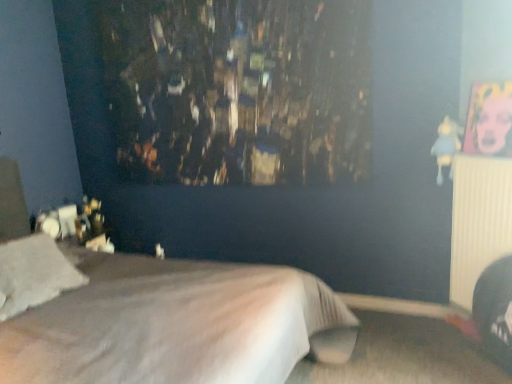
The height and width of the screenshot is (384, 512). What do you see at coordinates (34, 274) in the screenshot?
I see `white soft pillow at lower left` at bounding box center [34, 274].

Identify the location of white ribbed radiator at right. (478, 221).

Where is `white soft bed at center`? The image size is (512, 384). white soft bed at center is located at coordinates (159, 318).

Describe the element at coordinates (446, 146) in the screenshot. The height and width of the screenshot is (384, 512). I see `blue fabric doll at upper right` at that location.

Image resolution: width=512 pixels, height=384 pixels. What are the coordinates of `white soft pillow at lower left` in the screenshot? It's located at pos(34,274).

Which is more to the left, blue fabric doll at upper right or white ribbed radiator at right?

blue fabric doll at upper right is more to the left.

Which of these two, blue fabric doll at upper right or white ribbed radiator at right, is bigger?

white ribbed radiator at right is bigger.

Is blue fabric doll at upper right not near white ribbed radiator at right?

No, blue fabric doll at upper right is in close proximity to white ribbed radiator at right.

From a real-world perspective, between blue fabric doll at upper right and white ribbed radiator at right, who is vertically higher?

blue fabric doll at upper right is physically above.

Is point (191, 379) farther from viewer compared to point (476, 170)?

No.

Can you confirm if white soft bed at center is smaller than white ribbed radiator at right?

Incorrect, white soft bed at center is not smaller in size than white ribbed radiator at right.

Identify the location of bed below the white ribbed radiator at right (from the image's perspective). (159, 318).

From the image's perspective, between blue fabric doll at upper right and white soft bed at center, which one is located above?

blue fabric doll at upper right appears higher in the image.

Does point (444, 154) appear closer or farther from the camera than point (145, 310)?

Clearly, point (444, 154) is more distant from the camera than point (145, 310).

In terms of height, does blue fabric doll at upper right look taller or shorter compared to white soft bed at center?

blue fabric doll at upper right is shorter than white soft bed at center.

In terms of size, does blue fabric doll at upper right appear bigger or smaller than white soft bed at center?

Clearly, blue fabric doll at upper right is smaller in size than white soft bed at center.

From a real-world perspective, is white ribbed radiator at right located higher than white soft bed at center?

Correct, in the physical world, white ribbed radiator at right is higher than white soft bed at center.

Where is `radiator behind the white soft bed at center`? radiator behind the white soft bed at center is located at coordinates (478, 221).

Considering their positions, is white ribbed radiator at right located in front of or behind white soft bed at center?

Clearly, white ribbed radiator at right is behind white soft bed at center.

Is point (469, 225) closer or farther from the camera than point (20, 379)?

Point (469, 225).

Which object is wider, white soft bed at center or blue fabric doll at upper right?

white soft bed at center is wider.

Is white soft bed at center spatially inside blue fabric doll at upper right, or outside of it?

white soft bed at center exists outside the volume of blue fabric doll at upper right.

Could you tell me if white soft bed at center is facing blue fabric doll at upper right?

No, white soft bed at center is not facing towards blue fabric doll at upper right.

Considering the relative sizes of white soft bed at center and blue fabric doll at upper right in the image provided, is white soft bed at center bigger than blue fabric doll at upper right?

Yes.

Could white ribbed radiator at right be considered to be inside white soft pillow at lower left?

Actually, white ribbed radiator at right is outside white soft pillow at lower left.

You are a GUI agent. You are given a task and a screenshot of the screen. Output one action in this format:
    pyautogui.click(x=<x>, y=<y>)
    Task: Click on the pillow to the left of white ribbed radiator at right
    
    Given the screenshot: What is the action you would take?
    pyautogui.click(x=34, y=274)

From a real-world perspective, is white soft pillow at lower left positioned above or below white ribbed radiator at right?

In terms of real-world spatial position, white soft pillow at lower left is above white ribbed radiator at right.

How distant is white soft pillow at lower left from white ribbed radiator at right?

white soft pillow at lower left and white ribbed radiator at right are 2.31 meters apart from each other.

From a real-world perspective, is white ribbed radiator at right positioned above or below blue fabric doll at upper right?

In terms of real-world spatial position, white ribbed radiator at right is below blue fabric doll at upper right.

Choose the correct answer: Is white ribbed radiator at right inside blue fabric doll at upper right or outside it?

white ribbed radiator at right lies outside blue fabric doll at upper right.

Considering their positions, is white ribbed radiator at right located in front of or behind blue fabric doll at upper right?

In the image, white ribbed radiator at right appears in front of blue fabric doll at upper right.

The image size is (512, 384). Find the location of `toy behind the white ribbed radiator at right`. toy behind the white ribbed radiator at right is located at coordinates (446, 146).

Find the location of a particular element. radiator above the white soft bed at center (from the image's perspective) is located at coordinates (478, 221).

From the image, which object appears to be nearer to blue fabric doll at upper right, white soft pillow at lower left or white ribbed radiator at right?

white ribbed radiator at right.

From the image, which object appears to be farther from white ribbed radiator at right, white soft bed at center or white soft pillow at lower left?

white soft pillow at lower left is further to white ribbed radiator at right.

From the image, which object appears to be farther from white soft bed at center, blue fabric doll at upper right or white soft pillow at lower left?

blue fabric doll at upper right is further to white soft bed at center.

Considering their positions, is white ribbed radiator at right positioned closer to white soft pillow at lower left than white soft bed at center?

white soft bed at center is closer to white soft pillow at lower left.

Looking at this image, when comparing their distances from blue fabric doll at upper right, does white soft bed at center or white soft pillow at lower left seem further?

white soft pillow at lower left.

Which object lies further to the anchor point white soft pillow at lower left, white ribbed radiator at right or blue fabric doll at upper right?

Among the two, blue fabric doll at upper right is located further to white soft pillow at lower left.

Which object lies nearer to the anchor point white soft pillow at lower left, blue fabric doll at upper right or white soft bed at center?

white soft bed at center lies closer to white soft pillow at lower left than the other object.

Considering their positions, is white ribbed radiator at right positioned closer to blue fabric doll at upper right than white soft bed at center?

Among the two, white ribbed radiator at right is located nearer to blue fabric doll at upper right.

The height and width of the screenshot is (384, 512). I want to click on bed located between white soft pillow at lower left and white ribbed radiator at right in the left-right direction, so click(x=159, y=318).

At what (x,y) coordinates should I click in order to perform the action: click on toy located between white soft pillow at lower left and white ribbed radiator at right in the left-right direction. Please return your answer as a coordinate pair (x, y). This screenshot has width=512, height=384. Looking at the image, I should click on (446, 146).

Locate an element on the screen. The width and height of the screenshot is (512, 384). toy located between white soft bed at center and white ribbed radiator at right in the left-right direction is located at coordinates (446, 146).

Find the location of a particular element. The height and width of the screenshot is (384, 512). bed located between white soft pillow at lower left and blue fabric doll at upper right in the left-right direction is located at coordinates (159, 318).